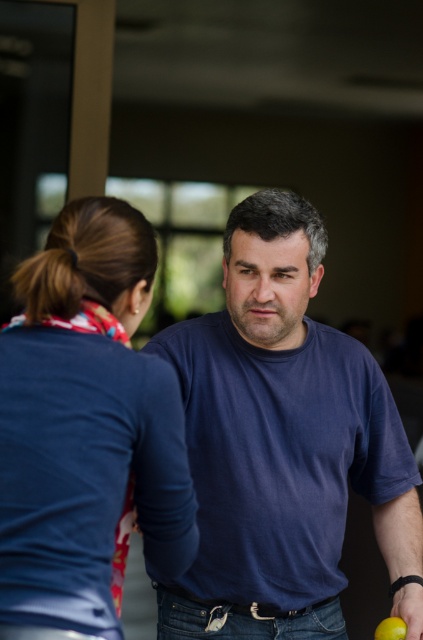
Who is more distant from viewer, [189,592] or [379,634]?

The point [189,592] is behind.

Can you confirm if dark blue t-shirt at center is bigger than green matte lime at lower right?

Yes.

Is point (238, 460) farther from viewer compared to point (384, 632)?

Yes, point (238, 460) is behind point (384, 632).

Locate an element on the screen. Image resolution: width=423 pixels, height=640 pixels. dark blue t-shirt at center is located at coordinates (282, 445).

Is the position of dark blue t-shirt at center less distant than that of blue fabric shirt at upper left?

No, dark blue t-shirt at center is further to the viewer.

The width and height of the screenshot is (423, 640). I want to click on dark blue t-shirt at center, so click(282, 445).

Is point (236, 420) positioned before point (99, 573)?

No, it is not.

Identify the location of dark blue t-shirt at center. (282, 445).

Which is above, blue fabric shirt at upper left or green matte lime at lower right?

blue fabric shirt at upper left is above.

Is blue fabric shirt at upper left shorter than green matte lime at lower right?

Incorrect, blue fabric shirt at upper left's height does not fall short of green matte lime at lower right's.

Measure the distance between point (32, 545) and camera.

They are 1.41 meters apart.

Locate an element on the screen. This screenshot has width=423, height=640. blue fabric shirt at upper left is located at coordinates (85, 428).